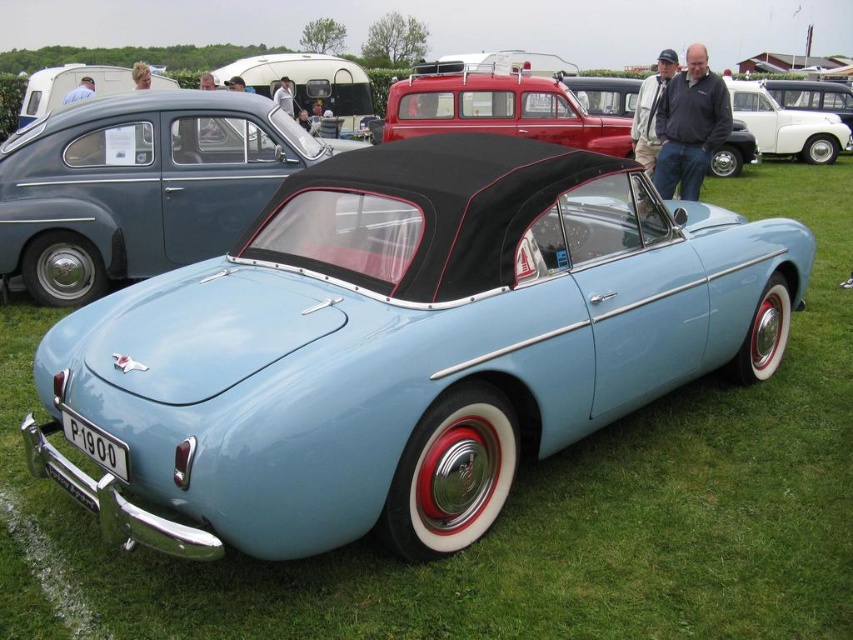
You are standing at the point marked as point (140, 186) in the image. What object are you currently standing on?

You are standing on the light blue matte convertible at center.

You are standing at the point with coordinates (x=140, y=186) in the image. What object are you directly facing?

The point at coordinates (x=140, y=186) directly faces the light blue matte convertible at center.

You are a photographer trying to capture the light blue matte convertible at center and the white glossy van at upper center in a single shot. Based on their sizes in the image, which vehicle should you focus on to ensure both are visible without cropping?

The light blue matte convertible at center is shorter than the white glossy van at upper center, so focusing on the taller white glossy van at upper center would allow both vehicles to fit within the frame since the convertible is shorter and less likely to be cut off.